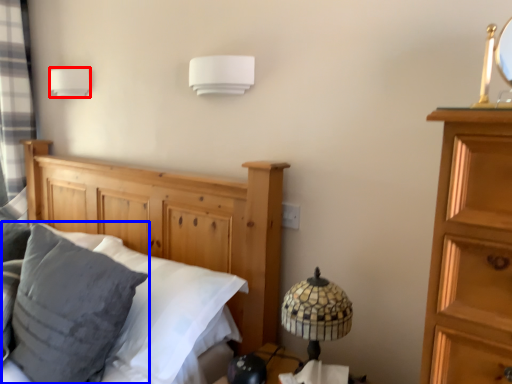
Question: Among these objects, which one is nearest to the camera, lamp (highlighted by a red box) or pillow (highlighted by a blue box)?

Choices:
 (A) lamp
 (B) pillow

Answer: (B)